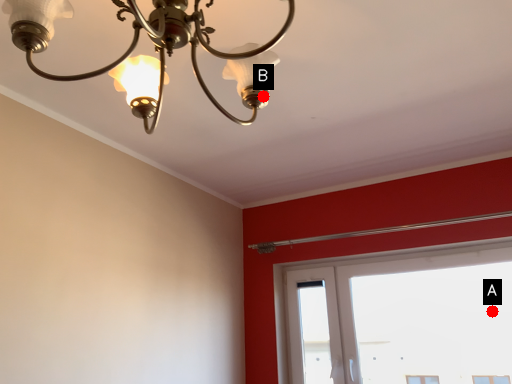
Question: Two points are circled on the image, labeled by A and B beside each circle. Which of the following is the farthest from the observer?

Choices:
 (A) A is further
 (B) B is further

Answer: (A)